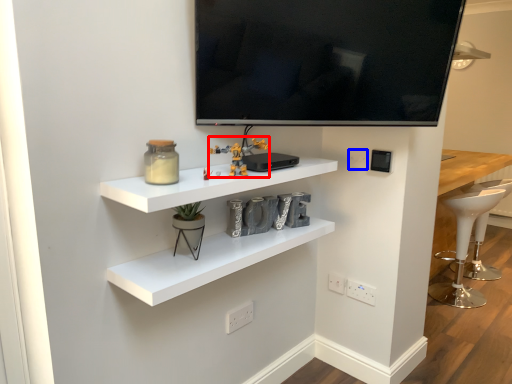
Question: Which point is closer to the camera, toy (highlighted by a red box) or electric outlet (highlighted by a blue box)?

Choices:
 (A) toy
 (B) electric outlet

Answer: (A)